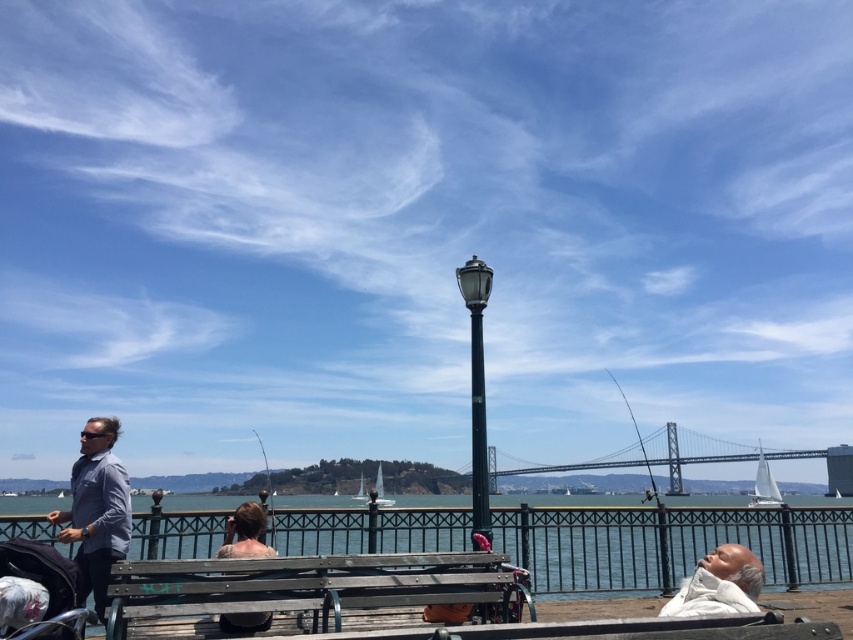
You are standing at the origin point of the image coordinate system. Which direction should you move to reach the wooden bench at center?

The wooden bench at center is located at coordinates point (311,593), so you should move towards the right and upwards to reach it.

You are an architect designing a new waterfront park. You need to place a new bench exactly 1 meter to the north of the black polished metal lamp post at center. Based on the image, where would this new bench be located relative to the existing wooden bench where two individuals are seated?

The black polished metal lamp post at center is located at coordinates (477,387). Placing a new bench 1 meter north would position it north of the lamp post. However, the existing wooden bench is in the foreground near the railing, so the new bench would be further north beyond the current bench area.

Consider the image. You are a photographer wanting to capture a photo of the black polished metal lamp post at center and the white fabric baby carriage at lower left. From the perspective of the photographer standing at the water edge, which object is closer to the left side of the frame?

The white fabric baby carriage at lower left is closer to the left side of the frame because the black polished metal lamp post at center is positioned on the right side of it.